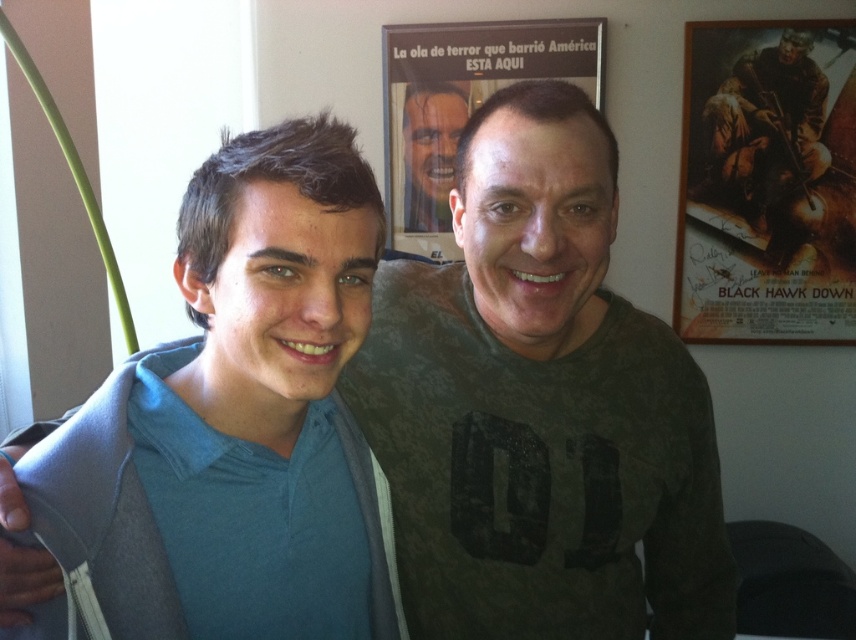
Does dark green textured shirt at center appear under blue cotton shirt at left?

Indeed, dark green textured shirt at center is positioned under blue cotton shirt at left.

Who is taller, dark green textured shirt at center or blue cotton shirt at left?

Standing taller between the two is dark green textured shirt at center.

Between point (520, 531) and point (210, 387), which one is positioned behind?

The point (520, 531) is behind.

I want to click on dark green textured shirt at center, so click(539, 406).

Between point (366, 355) and point (415, 164), which one is positioned behind?

Positioned behind is point (415, 164).

Is dark green textured shirt at center shorter than matte black face at center?

No, dark green textured shirt at center is not shorter than matte black face at center.

This screenshot has height=640, width=856. Identify the location of dark green textured shirt at center. (539, 406).

Is the position of blue cotton shirt at left more distant than that of matte black face at center?

No, blue cotton shirt at left is in front of matte black face at center.

Does blue cotton shirt at left have a greater width compared to matte black face at center?

Correct, the width of blue cotton shirt at left exceeds that of matte black face at center.

Who is more forward, (209, 204) or (435, 176)?

Point (209, 204) is in front.

This screenshot has height=640, width=856. Identify the location of blue cotton shirt at left. (275, 280).